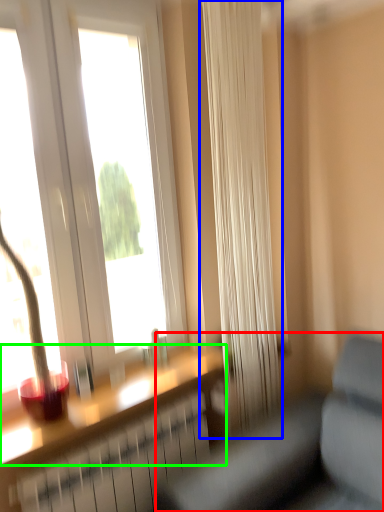
Question: Which is farther away from studio couch (highlighted by a red box)? curtain (highlighted by a blue box) or window sill (highlighted by a green box)?

Choices:
 (A) curtain
 (B) window sill

Answer: (A)